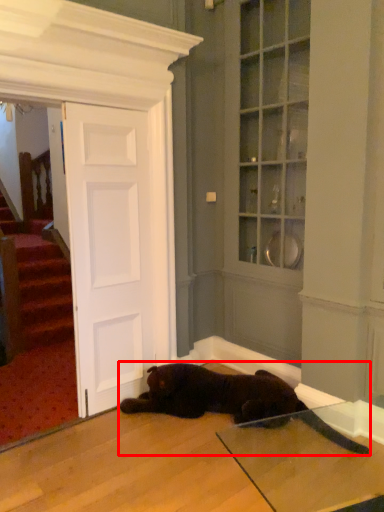
Question: Observing the image, what is the correct spatial positioning of cat (annotated by the red box) in reference to door?

Choices:
 (A) left
 (B) right

Answer: (B)